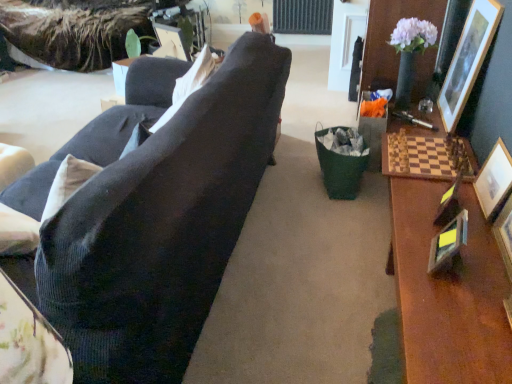
Describe the element at coordinates (468, 60) in the screenshot. This screenshot has width=512, height=384. I see `wooden picture frame at upper right, arranged as the 6th picture frame when viewed from the left` at that location.

This screenshot has height=384, width=512. What do you see at coordinates (172, 39) in the screenshot?
I see `matte plastic picture frame at upper center, which ranks as the first picture frame in left-to-right order` at bounding box center [172, 39].

You are a GUI agent. You are given a task and a screenshot of the screen. Output one action in this format:
    pyautogui.click(x=<x>, y=<y>)
    Task: Click on the wooden picture frame at right, placed as the 5th picture frame when sorted from left to right
    The image size is (512, 384).
    Given the screenshot: What is the action you would take?
    pyautogui.click(x=494, y=180)

Is metallic silver picture frame at right, positioned as the fifth picture frame in right-to-left order, not inside wooden picture frame at right, acting as the 3th picture frame starting from the right?

Indeed, metallic silver picture frame at right, positioned as the fifth picture frame in right-to-left order, is completely outside wooden picture frame at right, acting as the 3th picture frame starting from the right.

Are metallic silver picture frame at right, the second picture frame viewed from the left, and wooden picture frame at right, acting as the 3th picture frame starting from the right, making contact?

metallic silver picture frame at right, the second picture frame viewed from the left, and wooden picture frame at right, acting as the 3th picture frame starting from the right, are not in contact.

You are a GUI agent. You are given a task and a screenshot of the screen. Output one action in this format:
    pyautogui.click(x=<x>, y=<y>)
    Task: Click on the picture frame that is the 1st object located behind the wooden picture frame at right, acting as the 3th picture frame starting from the right
    The image size is (512, 384).
    Given the screenshot: What is the action you would take?
    pyautogui.click(x=448, y=243)

From a real-world perspective, does metallic silver picture frame at right, positioned as the fifth picture frame in right-to-left order, sit lower than wooden picture frame at right, the 4th picture frame when ordered from left to right?

Yes, from a real-world perspective, metallic silver picture frame at right, positioned as the fifth picture frame in right-to-left order, is beneath wooden picture frame at right, the 4th picture frame when ordered from left to right.

In order to click on the 3rd picture frame behind the wooden picture frame at right, the 4th picture frame when ordered from left to right, starting your count from the anchor in this screenshot , I will do `click(449, 203)`.

From the image's perspective, between metallic gold picture frame at right, the 4th picture frame from the right, and wooden picture frame at right, acting as the 3th picture frame starting from the right, which one is located above?

metallic gold picture frame at right, the 4th picture frame from the right, from the image's perspective.

Is metallic gold picture frame at right, the 4th picture frame from the right, next to wooden picture frame at right, the 4th picture frame when ordered from left to right?

No, metallic gold picture frame at right, the 4th picture frame from the right, is not in contact with wooden picture frame at right, the 4th picture frame when ordered from left to right.

From the picture: Is wooden picture frame at right, the 4th picture frame when ordered from left to right, positioned in front of metallic gold picture frame at right, placed as the 3th picture frame when sorted from left to right?

Yes, wooden picture frame at right, the 4th picture frame when ordered from left to right, is in front of metallic gold picture frame at right, placed as the 3th picture frame when sorted from left to right.

Which point is more distant from viewer, (510, 198) or (440, 214)?

The point (440, 214) is more distant.

Do you think wooden picture frame at right, acting as the 3th picture frame starting from the right, is within metallic gold picture frame at right, the 4th picture frame from the right, or outside of it?

wooden picture frame at right, acting as the 3th picture frame starting from the right, lies outside metallic gold picture frame at right, the 4th picture frame from the right.

From the image's perspective, between wooden picture frame at right, the 4th picture frame when ordered from left to right, and wooden picture frame at upper right, arranged as the 6th picture frame when viewed from the left, who is located below?

wooden picture frame at right, the 4th picture frame when ordered from left to right, from the image's perspective.

Are wooden picture frame at right, the 4th picture frame when ordered from left to right, and wooden picture frame at upper right, arranged as the 6th picture frame when viewed from the left, far apart?

Yes.

From a real-world perspective, which is physically above, wooden picture frame at right, acting as the 3th picture frame starting from the right, or wooden picture frame at upper right, which is the first picture frame in right-to-left order?

In real-world perspective, wooden picture frame at upper right, which is the first picture frame in right-to-left order, is above.

Is point (457, 198) behind point (198, 80)?

That is False.

Is there a large distance between metallic gold picture frame at right, the 4th picture frame from the right, and white fabric pillow at upper center?

Yes, metallic gold picture frame at right, the 4th picture frame from the right, and white fabric pillow at upper center are quite far apart.

In terms of height, does metallic gold picture frame at right, the 4th picture frame from the right, look taller or shorter compared to white fabric pillow at upper center?

In the image, metallic gold picture frame at right, the 4th picture frame from the right, appears to be shorter than white fabric pillow at upper center.

Does metallic gold picture frame at right, the 4th picture frame from the right, appear on the right side of white fabric pillow at upper center?

Yes, metallic gold picture frame at right, the 4th picture frame from the right, is to the right of white fabric pillow at upper center.

From a real-world perspective, is wooden picture frame at right, the second picture frame positioned from the right, on top of matte plastic picture frame at upper center, acting as the sixth picture frame starting from the right?

No, from a real-world perspective, wooden picture frame at right, the second picture frame positioned from the right, is not over matte plastic picture frame at upper center, acting as the sixth picture frame starting from the right

Is wooden picture frame at right, placed as the 5th picture frame when sorted from left to right, turned away from matte plastic picture frame at upper center, acting as the sixth picture frame starting from the right?

wooden picture frame at right, placed as the 5th picture frame when sorted from left to right, is not turned away from matte plastic picture frame at upper center, acting as the sixth picture frame starting from the right.

Between wooden picture frame at right, the second picture frame positioned from the right, and matte plastic picture frame at upper center, acting as the sixth picture frame starting from the right, which one is positioned behind?

matte plastic picture frame at upper center, acting as the sixth picture frame starting from the right, is more distant.

Can you tell me how much matte plastic picture frame at upper center, which ranks as the first picture frame in left-to-right order, and wooden picture frame at upper right, which is the first picture frame in right-to-left order, differ in facing direction?

The angular difference between matte plastic picture frame at upper center, which ranks as the first picture frame in left-to-right order, and wooden picture frame at upper right, which is the first picture frame in right-to-left order, is 121 degrees.

Is matte plastic picture frame at upper center, acting as the sixth picture frame starting from the right, aimed at wooden picture frame at upper right, arranged as the 6th picture frame when viewed from the left?

No, matte plastic picture frame at upper center, acting as the sixth picture frame starting from the right, is not facing towards wooden picture frame at upper right, arranged as the 6th picture frame when viewed from the left.

Is matte plastic picture frame at upper center, which ranks as the first picture frame in left-to-right order, taller or shorter than wooden picture frame at upper right, arranged as the 6th picture frame when viewed from the left?

Clearly, matte plastic picture frame at upper center, which ranks as the first picture frame in left-to-right order, is shorter compared to wooden picture frame at upper right, arranged as the 6th picture frame when viewed from the left.

Measure the distance between matte plastic picture frame at upper center, which ranks as the first picture frame in left-to-right order, and wooden picture frame at upper right, which is the first picture frame in right-to-left order.

1.73 meters.

Locate an element on the screen. Image resolution: width=512 pixels, height=384 pixels. picture frame located below the wooden picture frame at right, acting as the 3th picture frame starting from the right (from the image's perspective) is located at coordinates (448, 243).

I want to click on the 2nd picture frame positioned below the wooden picture frame at right, the 4th picture frame when ordered from left to right (from a real-world perspective), so click(x=449, y=203).

Considering their positions, is wooden picture frame at right, the second picture frame positioned from the right, positioned closer to wooden picture frame at upper right, arranged as the 6th picture frame when viewed from the left, than white fabric pillow at upper center?

Among the two, wooden picture frame at right, the second picture frame positioned from the right, is located nearer to wooden picture frame at upper right, arranged as the 6th picture frame when viewed from the left.

When comparing their distances from metallic silver picture frame at right, the second picture frame viewed from the left, does metallic gold picture frame at right, placed as the 3th picture frame when sorted from left to right, or wooden picture frame at right, the 4th picture frame when ordered from left to right, seem further?

wooden picture frame at right, the 4th picture frame when ordered from left to right, lies further to metallic silver picture frame at right, the second picture frame viewed from the left, than the other object.

When comparing their distances from metallic silver picture frame at right, the second picture frame viewed from the left, does wooden picture frame at upper right, which is the first picture frame in right-to-left order, or matte plastic picture frame at upper center, which ranks as the first picture frame in left-to-right order, seem closer?

Among the two, wooden picture frame at upper right, which is the first picture frame in right-to-left order, is located nearer to metallic silver picture frame at right, the second picture frame viewed from the left.

Consider the image. Estimate the real-world distances between objects in this image. Which object is closer to white fabric pillow at upper center, metallic gold picture frame at right, the 4th picture frame from the right, or wooden picture frame at right, placed as the 5th picture frame when sorted from left to right?

Among the two, metallic gold picture frame at right, the 4th picture frame from the right, is located nearer to white fabric pillow at upper center.

Based on their spatial positions, is metallic gold picture frame at right, placed as the 3th picture frame when sorted from left to right, or wooden picture frame at right, acting as the 3th picture frame starting from the right, closer to white fabric pillow at upper center?

metallic gold picture frame at right, placed as the 3th picture frame when sorted from left to right, is closer to white fabric pillow at upper center.

Based on their spatial positions, is white fabric pillow at upper center or matte plastic picture frame at upper center, which ranks as the first picture frame in left-to-right order, closer to wooden picture frame at right, acting as the 3th picture frame starting from the right?

Based on the image, white fabric pillow at upper center appears to be nearer to wooden picture frame at right, acting as the 3th picture frame starting from the right.

From the image, which object appears to be nearer to wooden picture frame at right, acting as the 3th picture frame starting from the right, metallic gold picture frame at right, placed as the 3th picture frame when sorted from left to right, or wooden picture frame at right, the second picture frame positioned from the right?

Based on the image, wooden picture frame at right, the second picture frame positioned from the right, appears to be nearer to wooden picture frame at right, acting as the 3th picture frame starting from the right.

Considering their positions, is wooden picture frame at upper right, which is the first picture frame in right-to-left order, positioned further to wooden picture frame at right, the 4th picture frame when ordered from left to right, than white fabric pillow at upper center?

Based on the image, white fabric pillow at upper center appears to be further to wooden picture frame at right, the 4th picture frame when ordered from left to right.

What are the coordinates of `picture frame between white fabric pillow at upper center and metallic gold picture frame at right, the 4th picture frame from the right, in the horizontal direction` in the screenshot? It's located at (448, 243).

The image size is (512, 384). Find the location of `picture frame between wooden picture frame at upper right, which is the first picture frame in right-to-left order, and metallic gold picture frame at right, placed as the 3th picture frame when sorted from left to right, from top to bottom`. picture frame between wooden picture frame at upper right, which is the first picture frame in right-to-left order, and metallic gold picture frame at right, placed as the 3th picture frame when sorted from left to right, from top to bottom is located at coordinates point(494,180).

I want to click on pillow between matte plastic picture frame at upper center, acting as the sixth picture frame starting from the right, and wooden picture frame at right, placed as the 5th picture frame when sorted from left to right, from left to right, so click(188, 84).

Locate an element on the screen. The height and width of the screenshot is (384, 512). pillow located between matte plastic picture frame at upper center, acting as the sixth picture frame starting from the right, and wooden picture frame at right, the 4th picture frame when ordered from left to right, in the left-right direction is located at coordinates (188, 84).